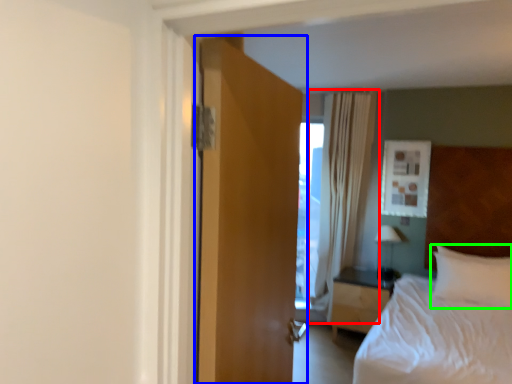
Question: Which is farther away from curtain (highlighted by a red box)? door (highlighted by a blue box) or pillow (highlighted by a green box)?

Choices:
 (A) door
 (B) pillow

Answer: (A)